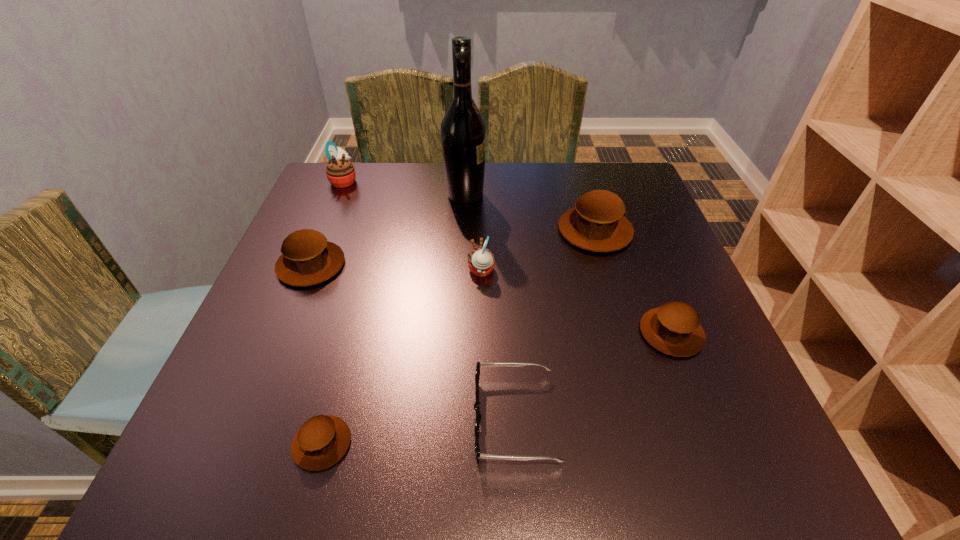
Where is `the tallest object`? Image resolution: width=960 pixels, height=540 pixels. the tallest object is located at coordinates (463, 129).

Identify the location of black wine bottle. This screenshot has width=960, height=540. 463,129.

Where is `the left pink muffin`? Image resolution: width=960 pixels, height=540 pixels. the left pink muffin is located at coordinates (340, 172).

You are a GUI agent. You are given a task and a screenshot of the screen. Output one action in this format:
    pyautogui.click(x=<x>, y=<y>)
    Task: Click on the bigger pink muffin
    This screenshot has height=540, width=960.
    Given the screenshot: What is the action you would take?
    pyautogui.click(x=340, y=172)

This screenshot has width=960, height=540. I want to click on the biggest brown muffin, so click(x=596, y=223).

Locate an element on the screen. The width and height of the screenshot is (960, 540). the third muffin from right to left is located at coordinates (481, 261).

This screenshot has height=540, width=960. I want to click on the smaller pink muffin, so click(481, 261).

You are a GUI agent. You are given a task and a screenshot of the screen. Output one action in this format:
    pyautogui.click(x=<x>, y=<y>)
    Task: Click on the third smallest brown muffin
    
    Given the screenshot: What is the action you would take?
    pyautogui.click(x=307, y=258)

Locate an element on the screen. Image resolution: width=960 pixels, height=540 pixels. the third biggest brown muffin is located at coordinates (674, 328).

The height and width of the screenshot is (540, 960). In order to click on the fifth farthest muffin in this screenshot , I will do `click(674, 328)`.